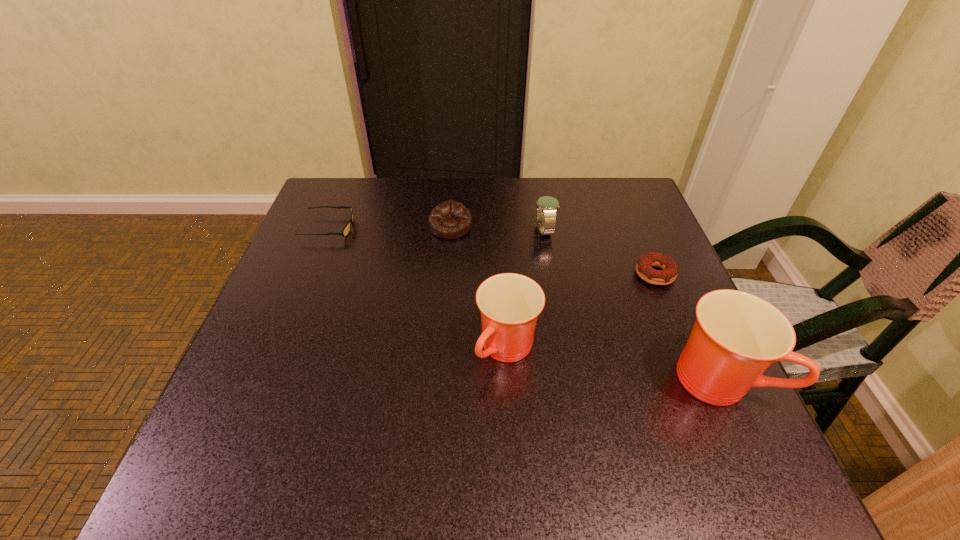
This screenshot has height=540, width=960. In order to click on the shorter cup in this screenshot , I will do `click(510, 303)`.

What are the coordinates of `the left cup` in the screenshot? It's located at (510, 303).

This screenshot has height=540, width=960. Identify the location of the tallest object. (737, 336).

The width and height of the screenshot is (960, 540). I want to click on the taller cup, so click(x=737, y=336).

This screenshot has width=960, height=540. In order to click on the third shortest object in this screenshot , I will do `click(450, 219)`.

Identify the location of the second object from left to right. (450, 219).

Where is `sunglasses`? The height and width of the screenshot is (540, 960). sunglasses is located at coordinates (347, 228).

I want to click on watch, so click(546, 206).

The height and width of the screenshot is (540, 960). I want to click on the fourth object from left to right, so click(546, 206).

This screenshot has width=960, height=540. I want to click on doughnut, so pyautogui.click(x=644, y=269).